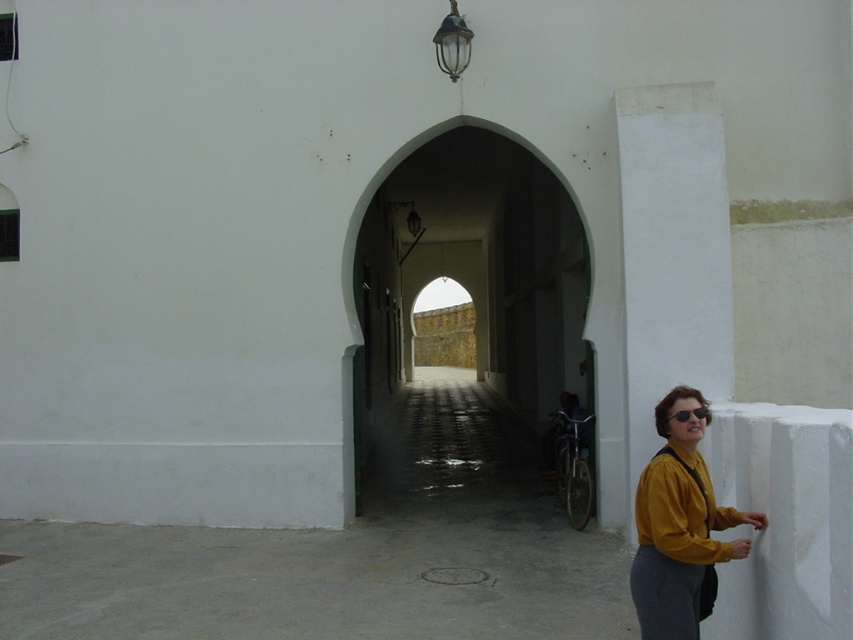
Question: Estimate the real-world distances between objects in this image. Which object is closer to the matte yellow jacket at lower right?

Choices:
 (A) white smooth pillar at right
 (B) shiny black sunglasses at right

Answer: (B)

Question: Is white stone archway at center bigger than white smooth pillar at right?

Choices:
 (A) yes
 (B) no

Answer: (A)

Question: Which object is closer to the camera taking this photo?

Choices:
 (A) matte yellow jacket at lower right
 (B) white smooth pillar at right
 (C) yellow matte shirt at lower right

Answer: (A)

Question: Is white stone archway at center positioned at the back of matte yellow jacket at lower right?

Choices:
 (A) yes
 (B) no

Answer: (A)

Question: In this image, where is white stone archway at center located relative to shiny black sunglasses at right?

Choices:
 (A) right
 (B) left

Answer: (B)

Question: Estimate the real-world distances between objects in this image. Which object is farther from the white smooth pillar at right?

Choices:
 (A) white stone archway at center
 (B) yellow matte shirt at lower right
 (C) matte yellow jacket at lower right

Answer: (A)